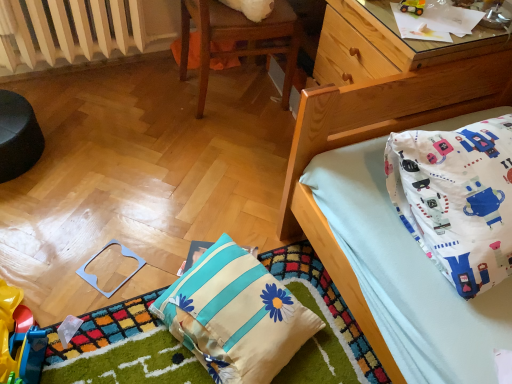
At what (x,y) coordinates should I click in order to perform the action: click on empty space that is ontop of light blue plastic square at lower left, which is counted as the second toy, starting from the top (from a real-world perspective). Please return your answer as a coordinate pair (x, y). This screenshot has height=384, width=512. Looking at the image, I should click on (106, 266).